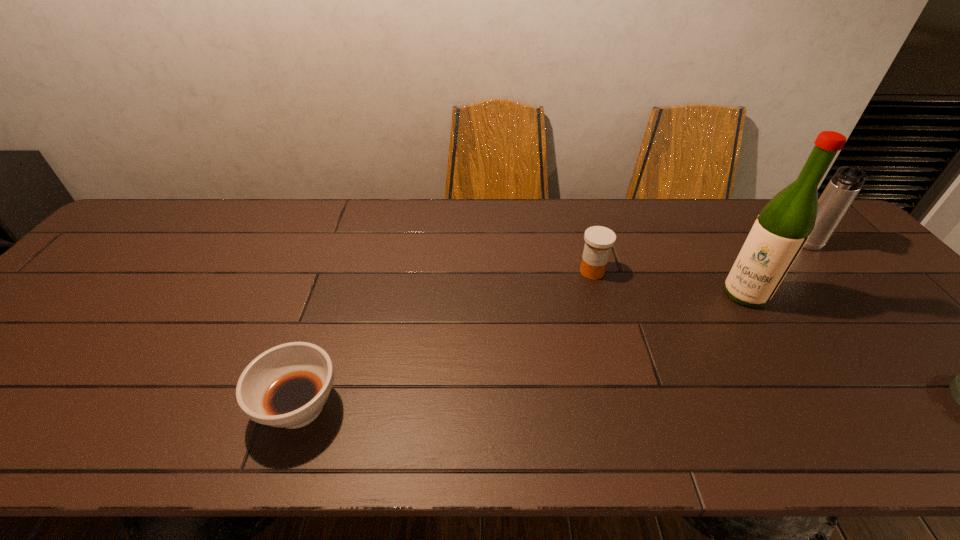
This screenshot has height=540, width=960. In order to click on soup bowl in this screenshot , I will do `click(286, 386)`.

Where is `the leftmost object`? The height and width of the screenshot is (540, 960). the leftmost object is located at coordinates (286, 386).

Where is `medicine`? This screenshot has height=540, width=960. medicine is located at coordinates tap(598, 240).

This screenshot has height=540, width=960. Identify the location of the third shortest object. (598, 240).

Image resolution: width=960 pixels, height=540 pixels. Identify the location of the farthest object. (844, 186).

Where is `thermos bottle`? thermos bottle is located at coordinates (844, 186).

Find the location of `the tallest object`. the tallest object is located at coordinates (782, 228).

I want to click on liquor, so tap(782, 228).

I want to click on free space located 0.380m on the right of the leftmost object, so click(x=525, y=407).

I want to click on free location located on the label of the third tallest object, so click(655, 383).